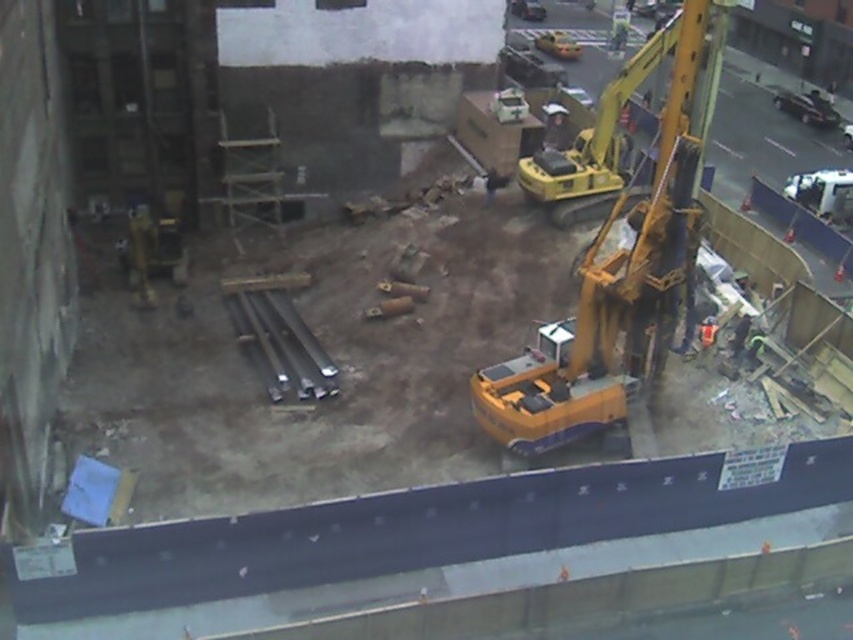
Question: Which object appears closest to the camera in this image?

Choices:
 (A) yellow hard hat at center
 (B) yellow metallic excavator at center

Answer: (B)

Question: Which of the following is the closest to the observer?

Choices:
 (A) yellow hard hat at center
 (B) yellow metallic excavator at center

Answer: (B)

Question: In this image, where is yellow metallic excavator at center located relative to yellow hard hat at center?

Choices:
 (A) right
 (B) left

Answer: (A)

Question: Can you confirm if yellow metallic excavator at center is wider than yellow hard hat at center?

Choices:
 (A) no
 (B) yes

Answer: (B)

Question: In this image, where is yellow metallic excavator at center located relative to yellow hard hat at center?

Choices:
 (A) right
 (B) left

Answer: (A)

Question: Which of the following is the farthest from the observer?

Choices:
 (A) (483, 374)
 (B) (544, 134)

Answer: (B)